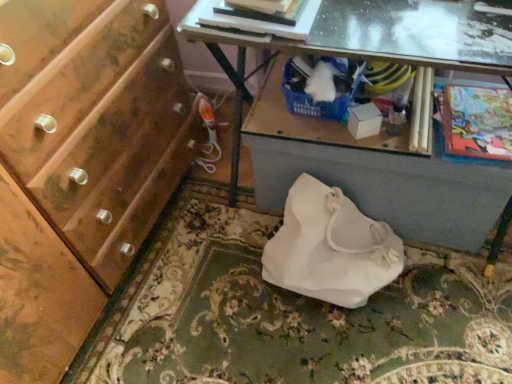
You are a GUI agent. You are given a task and a screenshot of the screen. Output one action in this format:
    pyautogui.click(x=<x>, y=<y>)
    Task: Click on the vacant space to the right of white cardboard box at center
    
    Given the screenshot: What is the action you would take?
    pyautogui.click(x=436, y=131)